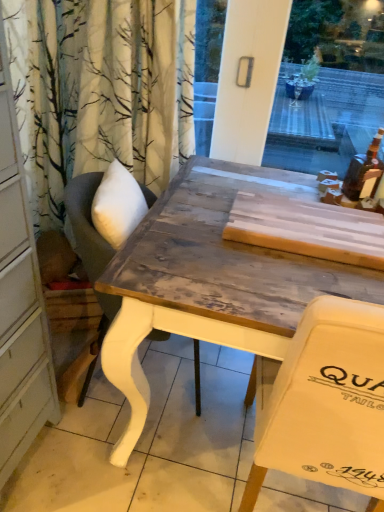
Question: Is wooden table at center further to the viewer compared to wooden chair at center?

Choices:
 (A) no
 (B) yes

Answer: (A)

Question: Is wooden table at center positioned with its back to wooden chair at center?

Choices:
 (A) no
 (B) yes

Answer: (A)

Question: From the image's perspective, is wooden table at center on wooden chair at center?

Choices:
 (A) no
 (B) yes

Answer: (A)

Question: Is wooden table at center closer to camera compared to wooden chair at center?

Choices:
 (A) yes
 (B) no

Answer: (A)

Question: Is wooden table at center thinner than wooden chair at center?

Choices:
 (A) yes
 (B) no

Answer: (B)

Question: From the image's perspective, is wooden chair at center located above or below wooden table at center?

Choices:
 (A) below
 (B) above

Answer: (B)

Question: Relative to wooden table at center, is wooden chair at center in front or behind?

Choices:
 (A) behind
 (B) front

Answer: (A)

Question: Looking at their shapes, would you say wooden chair at center is wider or thinner than wooden table at center?

Choices:
 (A) wide
 (B) thin

Answer: (B)

Question: Would you say wooden chair at center is to the left or to the right of wooden table at center in the picture?

Choices:
 (A) left
 (B) right

Answer: (A)

Question: Considering the positions of wooden table at center and translucent amber bottle at upper right in the image, is wooden table at center wider or thinner than translucent amber bottle at upper right?

Choices:
 (A) thin
 (B) wide

Answer: (B)

Question: Considering the positions of point (240, 278) and point (382, 169), is point (240, 278) closer or farther from the camera than point (382, 169)?

Choices:
 (A) farther
 (B) closer

Answer: (B)

Question: From a real-world perspective, is wooden table at center positioned above or below translucent amber bottle at upper right?

Choices:
 (A) below
 (B) above

Answer: (A)

Question: Considering the positions of wooden table at center and translucent amber bottle at upper right in the image, is wooden table at center taller or shorter than translucent amber bottle at upper right?

Choices:
 (A) short
 (B) tall

Answer: (B)

Question: From the image's perspective, is translucent amber bottle at upper right above or below wooden chair at center?

Choices:
 (A) below
 (B) above

Answer: (B)

Question: Would you say translucent amber bottle at upper right is inside or outside wooden chair at center?

Choices:
 (A) inside
 (B) outside

Answer: (B)